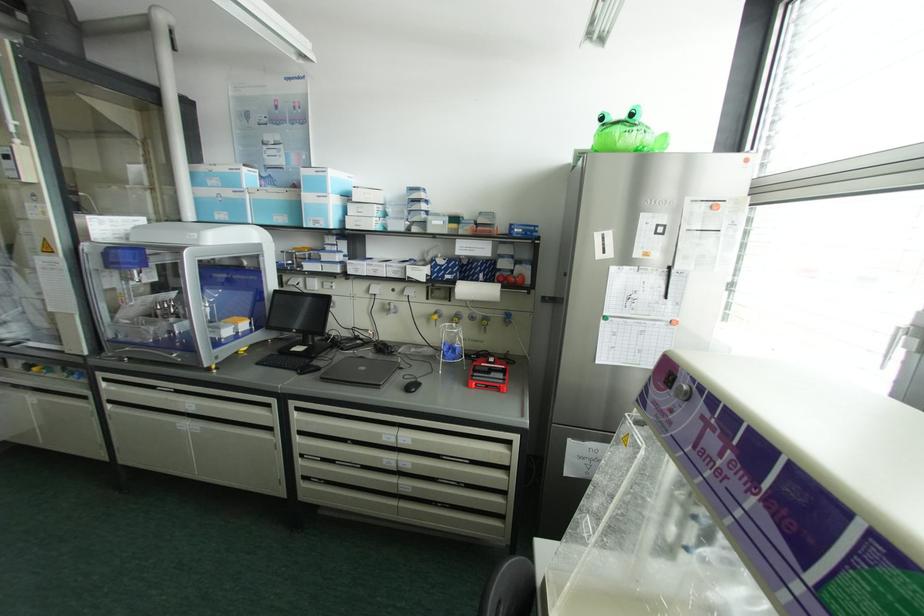
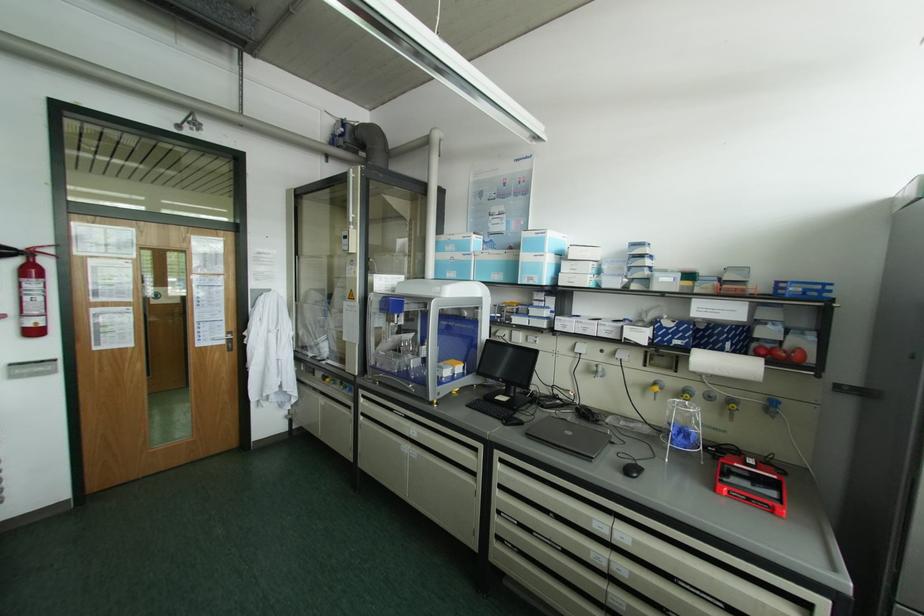
Question: How did the camera likely rotate?

Choices:
 (A) Left
 (B) Right
 (C) Up
 (D) Down

Answer: (A)